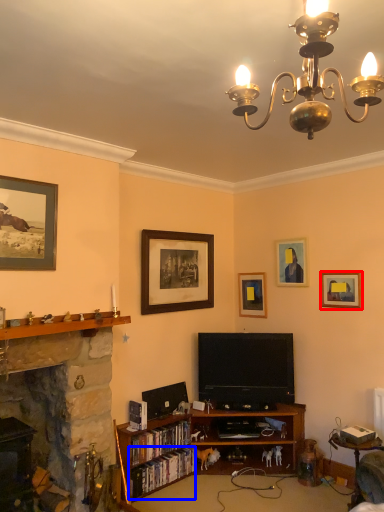
Question: Which point is further to the camera, picture frame (highlighted by a red box) or book (highlighted by a blue box)?

Choices:
 (A) picture frame
 (B) book

Answer: (A)